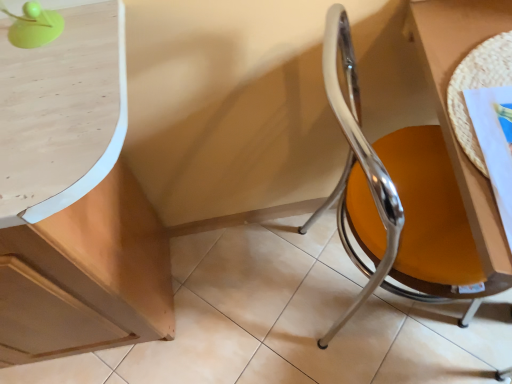
Question: Would you say green plastic ball at upper left is inside or outside woven mat at right?

Choices:
 (A) inside
 (B) outside

Answer: (B)

Question: From the image's perspective, is green plastic ball at upper left located above or below woven mat at right?

Choices:
 (A) below
 (B) above

Answer: (B)

Question: Which object is the closest to the light brown wood cabinet at left?

Choices:
 (A) woven mat at right
 (B) chrome/yellow seat at right
 (C) green plastic ball at upper left

Answer: (C)

Question: Estimate the real-world distances between objects in this image. Which object is closer to the chrome/yellow seat at right?

Choices:
 (A) woven mat at right
 (B) green plastic ball at upper left
 (C) light brown wood cabinet at left

Answer: (A)